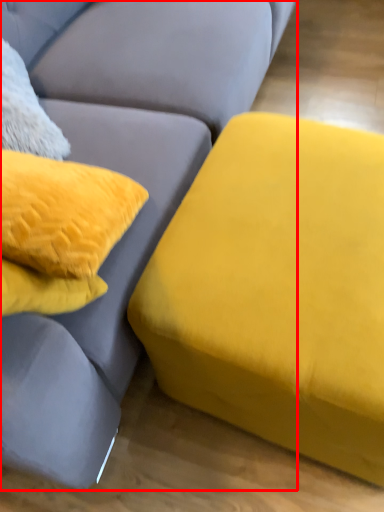
Question: In this image, where is studio couch (annotated by the red box) located relative to studio couch?

Choices:
 (A) right
 (B) left

Answer: (B)